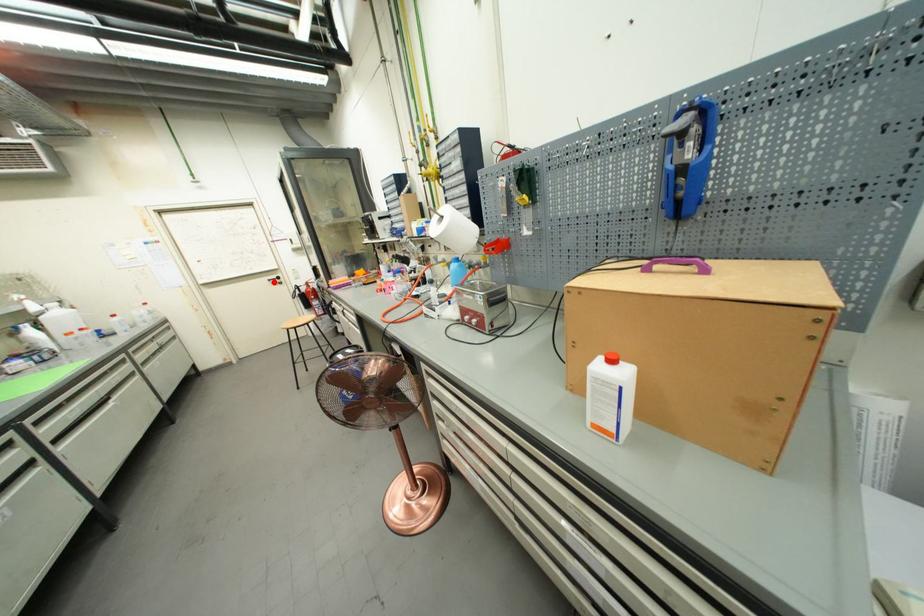
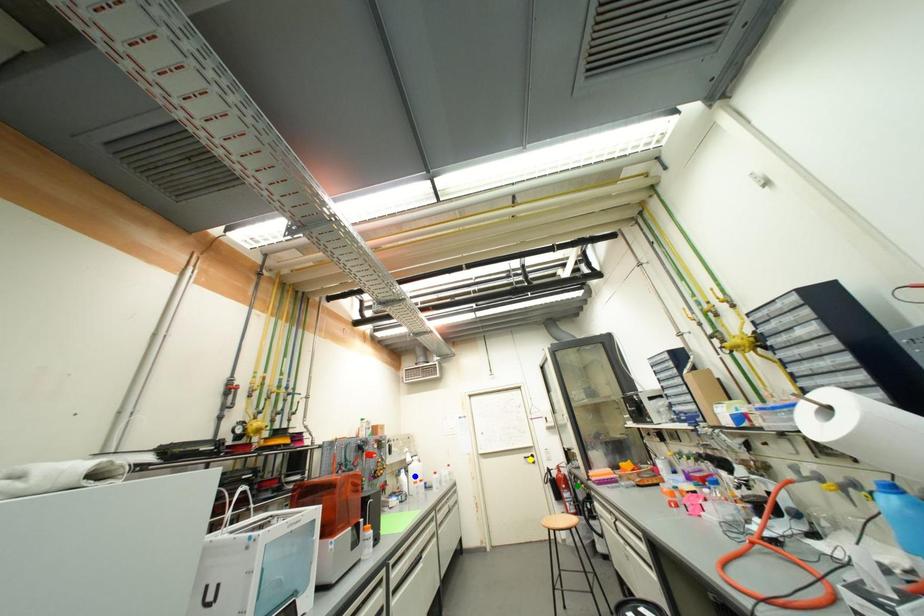
Question: I am providing you with two images of the same scene from different viewpoints. A red point is marked on the first image. You are given multiple points on the second image. Which point in image 2 represents the same 3d spot as the red point in image 1?

Choices:
 (A) blue point
 (B) green point
 (C) yellow point

Answer: (C)